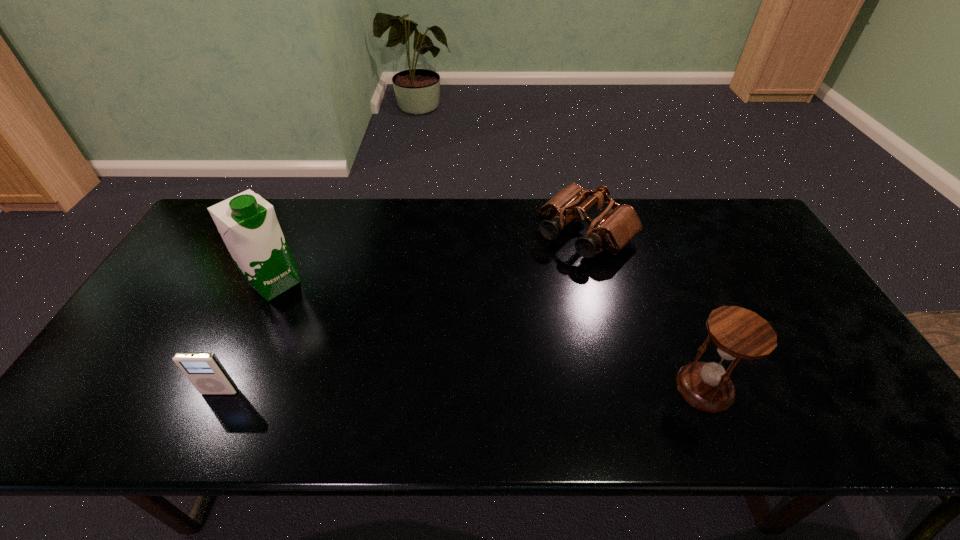
Where is `vacant space that's between the iPod and the second tallest object`? Image resolution: width=960 pixels, height=540 pixels. vacant space that's between the iPod and the second tallest object is located at coordinates (462, 390).

Locate an element on the screen. The image size is (960, 540). vacant space in between the iPod and the second tallest object is located at coordinates (462, 390).

The height and width of the screenshot is (540, 960). Find the location of `vacant space that is in between the second tallest object and the iPod`. vacant space that is in between the second tallest object and the iPod is located at coordinates (462, 390).

At what (x,y) coordinates should I click in order to perform the action: click on vacant area that lies between the binoculars and the iPod. Please return your answer as a coordinate pair (x, y). The width and height of the screenshot is (960, 540). Looking at the image, I should click on (403, 313).

I want to click on blank region between the tallest object and the iPod, so click(x=248, y=338).

Find the location of a particular element. unoccupied position between the binoculars and the iPod is located at coordinates coord(403,313).

Locate an element on the screen. This screenshot has height=540, width=960. vacant space in between the iPod and the third shortest object is located at coordinates (462, 390).

The width and height of the screenshot is (960, 540). I want to click on vacant area that lies between the iPod and the binoculars, so click(403, 313).

At what (x,y) coordinates should I click in order to perform the action: click on object that ranks as the third closest to the soya milk. Please return your answer as a coordinate pair (x, y). Image resolution: width=960 pixels, height=540 pixels. Looking at the image, I should click on (738, 333).

The width and height of the screenshot is (960, 540). Identify the location of object that is the second closest to the soya milk. (615, 227).